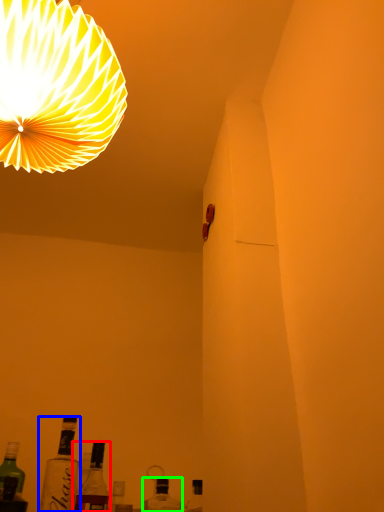
Question: Which is nearer to the bottle (highlighted by a red box)? bottle (highlighted by a blue box) or bottle (highlighted by a green box).

Choices:
 (A) bottle
 (B) bottle

Answer: (A)